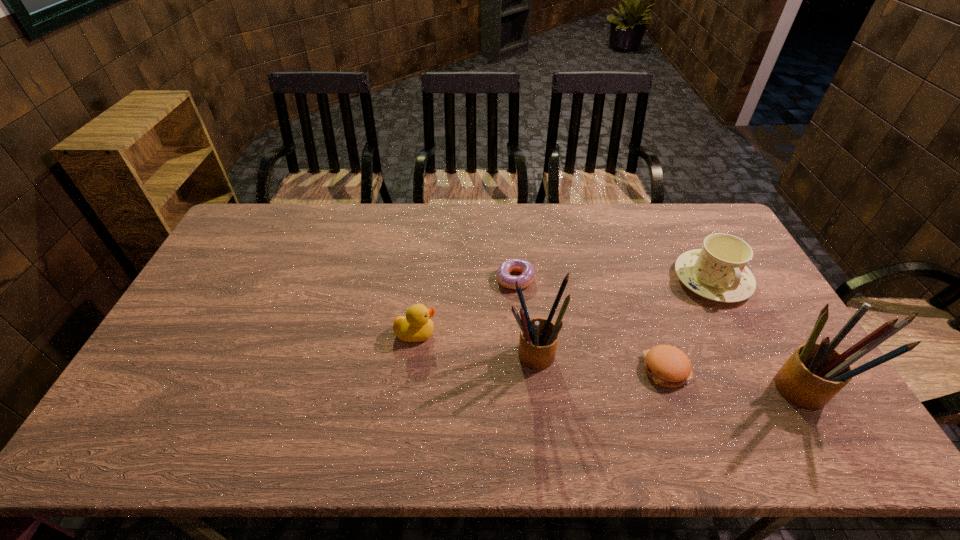
Locate an element on the screen. The width and height of the screenshot is (960, 540). vacant space located on the left of the right pencil box is located at coordinates pyautogui.click(x=690, y=389).

The image size is (960, 540). Identify the location of vacant position located 0.120m on the face of the third shortest object. [x=479, y=334].

Locate an element on the screen. This screenshot has width=960, height=540. vacant space situated on the handle side of the fourth shortest object is located at coordinates click(781, 411).

Find the location of a particular element. The width and height of the screenshot is (960, 540). vacant space situated 0.340m on the right of the doughnut is located at coordinates (639, 279).

This screenshot has height=540, width=960. In order to click on vacant space located 0.290m on the right of the fourth object from left to right in this screenshot , I will do `click(797, 370)`.

At what (x,y) coordinates should I click in order to perform the action: click on pencil box that is positioned at the near edge. Please return your answer as a coordinate pair (x, y). The image size is (960, 540). Looking at the image, I should click on (815, 372).

Image resolution: width=960 pixels, height=540 pixels. Identify the location of patty located at the near edge. (668, 366).

Locate an element on the screen. The height and width of the screenshot is (540, 960). pencil box that is at the right edge is located at coordinates (815, 372).

Where is `chinaware positioned at the right edge`? chinaware positioned at the right edge is located at coordinates (718, 271).

At what (x,y) coordinates should I click in order to perform the action: click on object that is at the near right corner. Please return your answer as a coordinate pair (x, y). This screenshot has height=540, width=960. Looking at the image, I should click on click(x=815, y=372).